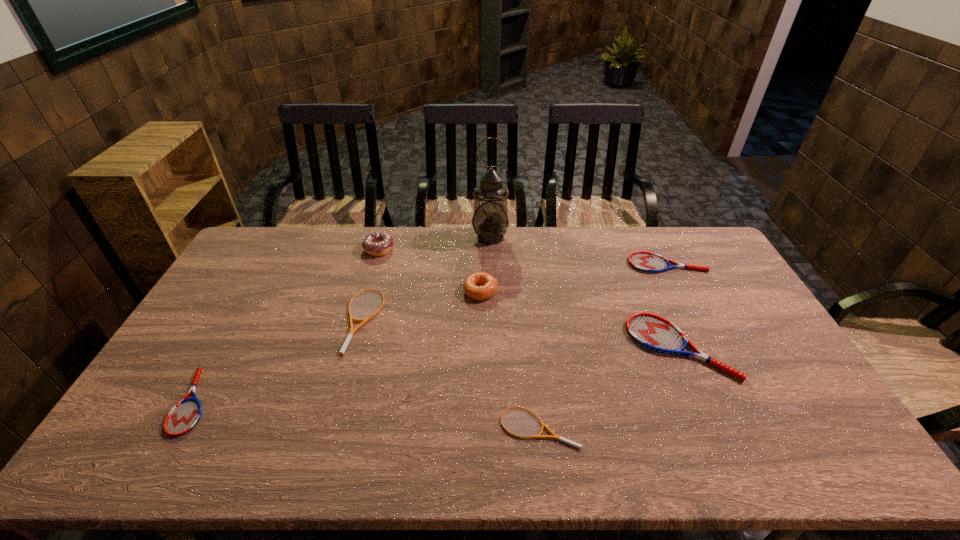
Where is `free space located on the left of the second tennis racket from left to right`? Image resolution: width=960 pixels, height=540 pixels. free space located on the left of the second tennis racket from left to right is located at coordinates (294, 321).

I want to click on free space located 0.060m on the back of the leftmost blue tennis racket, so click(x=222, y=353).

Locate an element on the screen. vacant space located 0.200m on the right of the smaller beige tennis racket is located at coordinates (659, 427).

Where is `oil lamp at the far edge`? This screenshot has width=960, height=540. oil lamp at the far edge is located at coordinates (490, 221).

Find the location of a particular element. The image size is (960, 540). doughnut situated at the far edge is located at coordinates (377, 243).

Where is `tennis racket present at the far edge`? This screenshot has height=540, width=960. tennis racket present at the far edge is located at coordinates (648, 262).

Find the location of `object that is at the left edge`. object that is at the left edge is located at coordinates (184, 416).

You are a GUI agent. You are given a task and a screenshot of the screen. Output one action in this format:
    pyautogui.click(x=<x>, y=<y>)
    Task: Click on the object present at the near left corner
    The width and height of the screenshot is (960, 540).
    Given the screenshot: What is the action you would take?
    pyautogui.click(x=184, y=416)

Locate an element on the screen. This screenshot has width=960, height=540. object at the far right corner is located at coordinates (648, 262).

This screenshot has width=960, height=540. In order to click on vacant point at the far edge in this screenshot , I will do `click(416, 232)`.